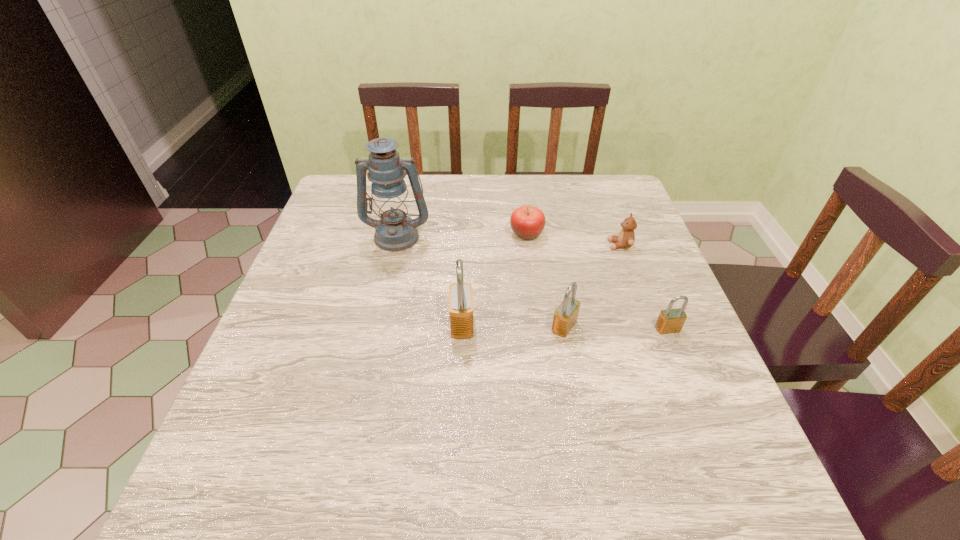
What are the coordinates of `vacant region located 0.090m on the front of the fourth shortest object` in the screenshot? It's located at (573, 374).

Find the location of a particular element. vacant space located 0.260m on the left of the shortest padlock is located at coordinates (535, 329).

The height and width of the screenshot is (540, 960). In order to click on vacant space located 0.230m on the front-facing side of the teddy bear in this screenshot , I will do `click(520, 245)`.

You are a GUI agent. You are given a task and a screenshot of the screen. Output one action in this format:
    pyautogui.click(x=<x>, y=<y>)
    Task: Click on the free region located 0.180m on the front-facing side of the teddy bear
    The width and height of the screenshot is (960, 540).
    Given the screenshot: What is the action you would take?
    pyautogui.click(x=540, y=245)

Identify the location of free location located 0.150m on the front-facing side of the teddy bear. The image size is (960, 540). (551, 245).

In order to click on free space located 0.100m on the front-facing side of the lantern in this screenshot , I will do `click(388, 279)`.

Find the location of `free space located on the left of the apple`. free space located on the left of the apple is located at coordinates (424, 234).

This screenshot has width=960, height=540. I want to click on object present at the left edge, so click(395, 231).

Locate an element on the screen. Image resolution: width=960 pixels, height=540 pixels. padlock present at the right edge is located at coordinates (x=671, y=320).

What are the coordinates of `teddy bear located in the right edge section of the desktop` in the screenshot? It's located at (626, 237).